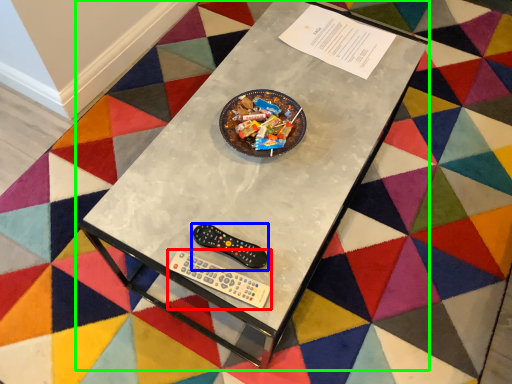
Question: Considering the real-world distances, which object is farthest from Wii controller (highlighted by a red box)? control (highlighted by a blue box) or table (highlighted by a green box)?

Choices:
 (A) control
 (B) table

Answer: (B)